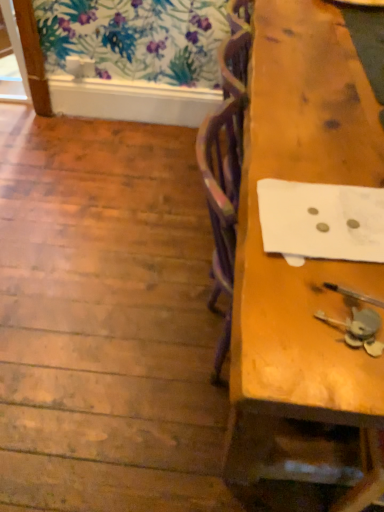
The width and height of the screenshot is (384, 512). What do you see at coordinates (308, 260) in the screenshot?
I see `wooden table at right` at bounding box center [308, 260].

At what (x,y) coordinates should I click in order to perform the action: click on wooden table at right. Please return your answer as a coordinate pair (x, y). The image size is (384, 512). Looking at the image, I should click on (308, 260).

In order to click on wooden table at right in this screenshot , I will do `click(308, 260)`.